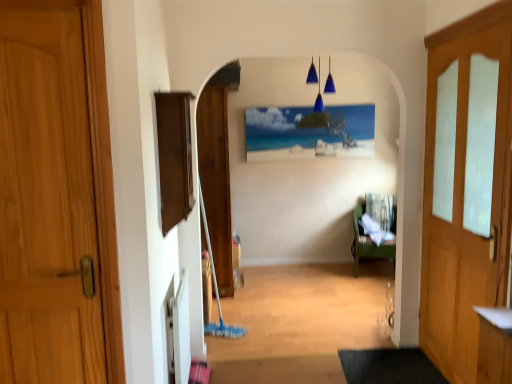
Question: From the image's perspective, relative to wooden door at right, the third door viewed from the left, is wooden door at left, the first door when ordered from left to right, above or below?

Choices:
 (A) above
 (B) below

Answer: (A)

Question: In the image, is wooden door at left, which is the third door from back to front, on the left side or the right side of wooden door at right, which ranks as the second door in front-to-back order?

Choices:
 (A) left
 (B) right

Answer: (A)

Question: Estimate the real-world distances between objects in this image. Which object is closer to the matte canvas painting at center?

Choices:
 (A) wooden door at right, which ranks as the second door in front-to-back order
 (B) green wicker chair at center-right
 (C) dark gray rubber doormat at lower center
 (D) wooden door at left, the 3th door when ordered from right to left
 (E) blue glass pendant lights at upper center

Answer: (E)

Question: Which object is positioned closest to the green wicker chair at center-right?

Choices:
 (A) blue glass pendant lights at upper center
 (B) wooden door at center, which appears as the 3th door when viewed from the front
 (C) wooden door at left, which is the third door from back to front
 (D) matte canvas painting at center
 (E) dark gray rubber doormat at lower center

Answer: (D)